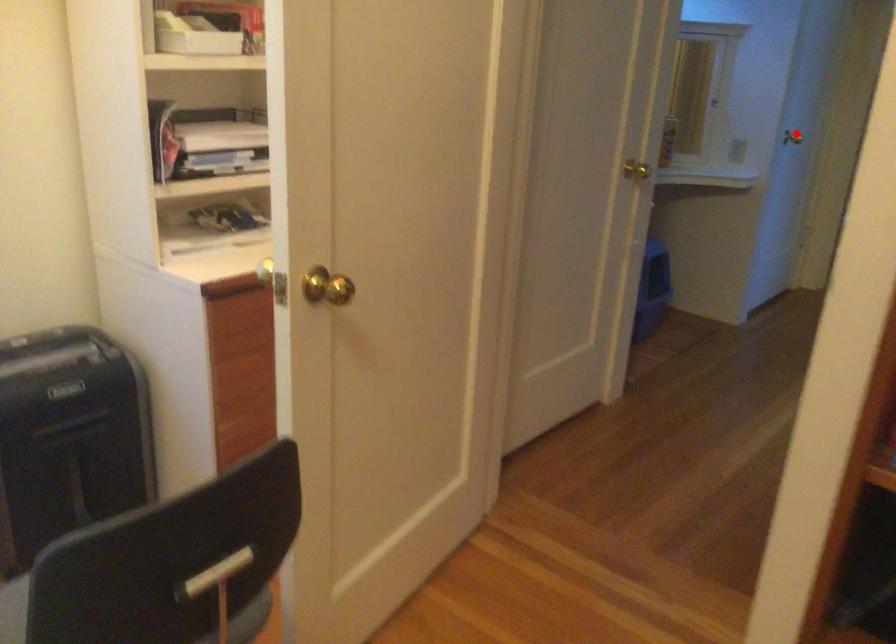
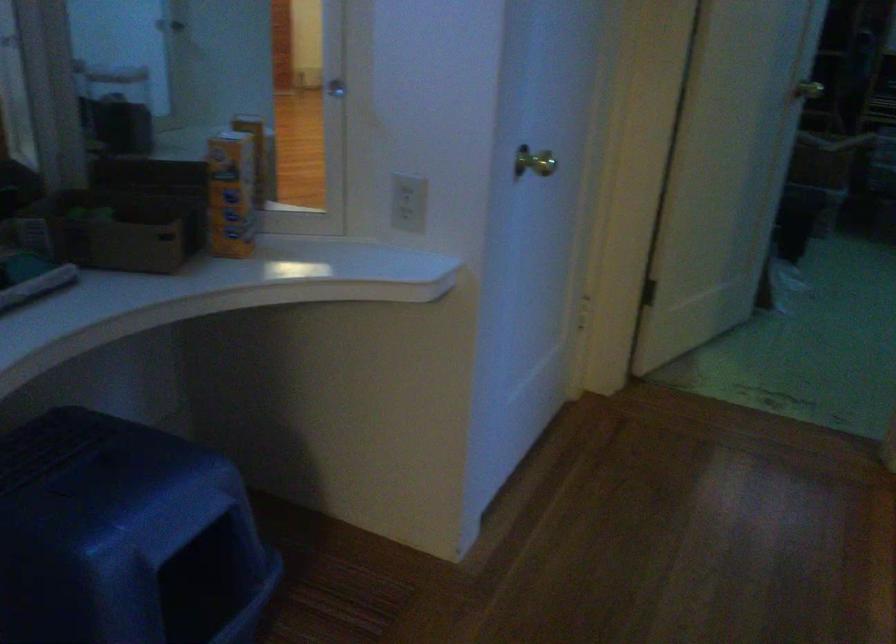
Question: I am providing you with two images of the same scene from different viewpoints. In image1, a red point is highlighted. Considering the same 3D point in image2, which of the following is correct?

Choices:
 (A) It is closer
 (B) It is farther

Answer: (A)